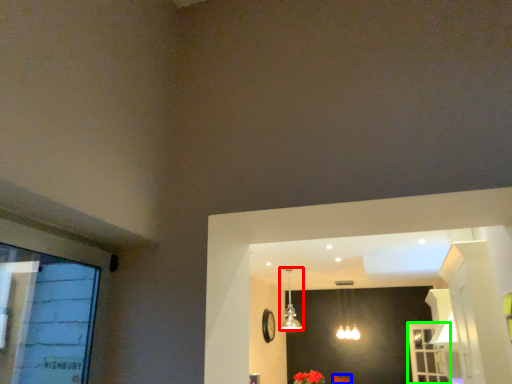
Question: Which object is the closest to the lamp (highlighted by a red box)? Choose among these: flower (highlighted by a blue box) or screen door (highlighted by a green box).

Choices:
 (A) flower
 (B) screen door

Answer: (A)